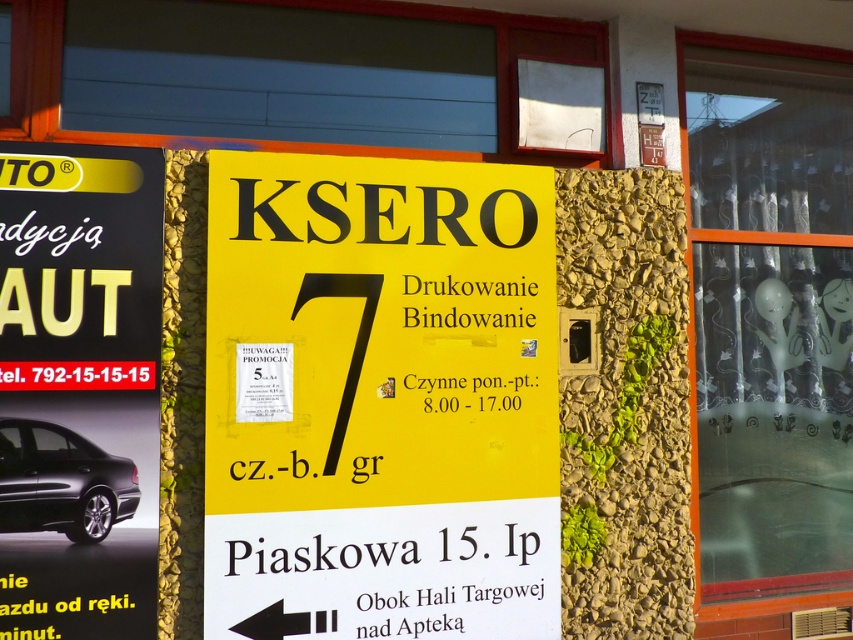
Question: Which object is closer to the camera taking this photo?

Choices:
 (A) yellow matte sign at left
 (B) black glossy car at left
 (C) yellow paper sign at center
 (D) shiny black car at left

Answer: (B)

Question: Among these objects, which one is farthest from the camera?

Choices:
 (A) shiny black car at left
 (B) yellow paper sign at center
 (C) black glossy car at left
 (D) transparent glass window at center

Answer: (D)

Question: From the image, what is the correct spatial relationship of yellow paper sign at center in relation to black glossy car at left?

Choices:
 (A) right
 (B) left

Answer: (A)

Question: Is transparent glass window at center bigger than shiny black car at left?

Choices:
 (A) no
 (B) yes

Answer: (B)

Question: Is black glossy car at left to the left of shiny black car at left from the viewer's perspective?

Choices:
 (A) yes
 (B) no

Answer: (B)

Question: Which object is positioned closest to the transparent glass window at center?

Choices:
 (A) shiny black car at left
 (B) yellow paper sign at center
 (C) black glossy car at left

Answer: (B)